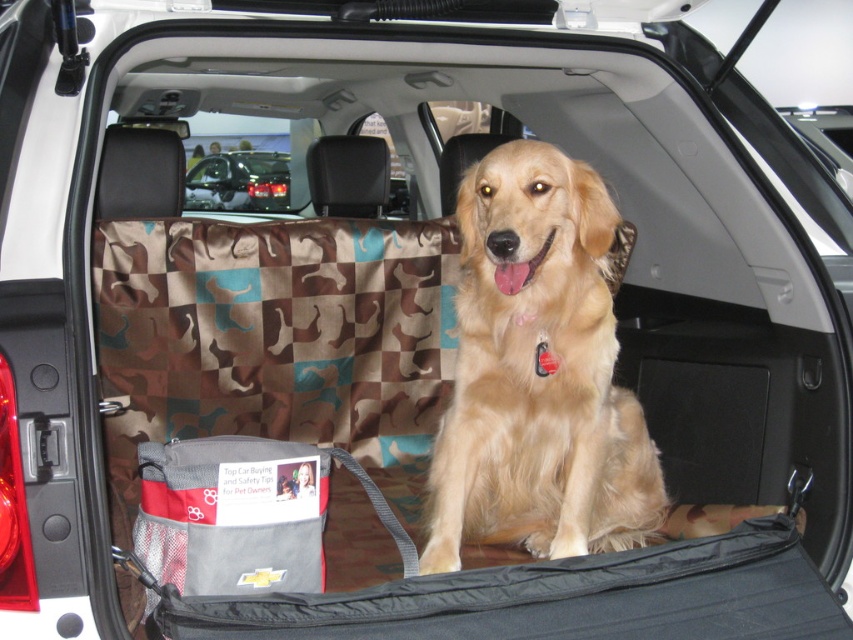
Is point (524, 256) closer to viewer compared to point (213, 156)?

Yes.

Who is more distant from viewer, (544, 326) or (271, 198)?

Point (271, 198)

Where is `golden fur dog at center`? The image size is (853, 640). golden fur dog at center is located at coordinates (537, 372).